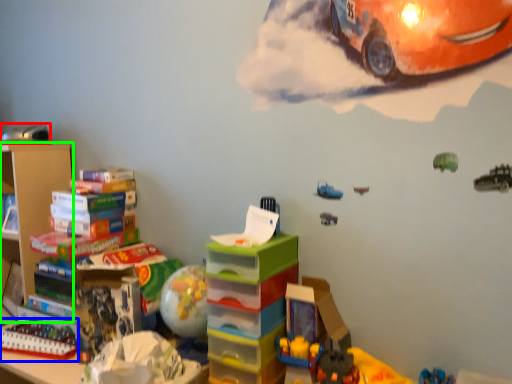
Question: Based on their relative distances, which object is nearer to toy (highlighted by a red box)? Choose from toy (highlighted by a blue box) and shelf (highlighted by a green box).

Choices:
 (A) toy
 (B) shelf

Answer: (B)